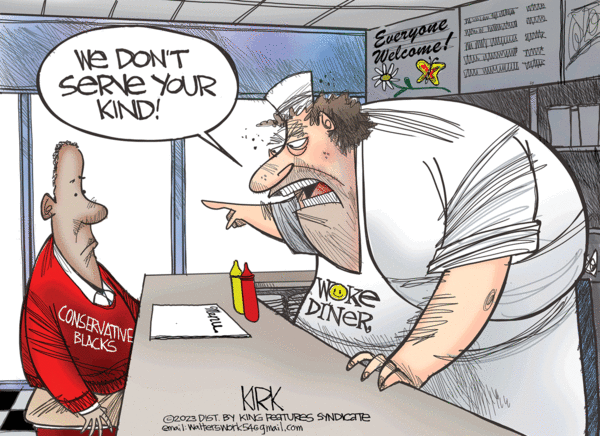
The height and width of the screenshot is (436, 600). Find the location of `neutral counter`. neutral counter is located at coordinates (210, 361).